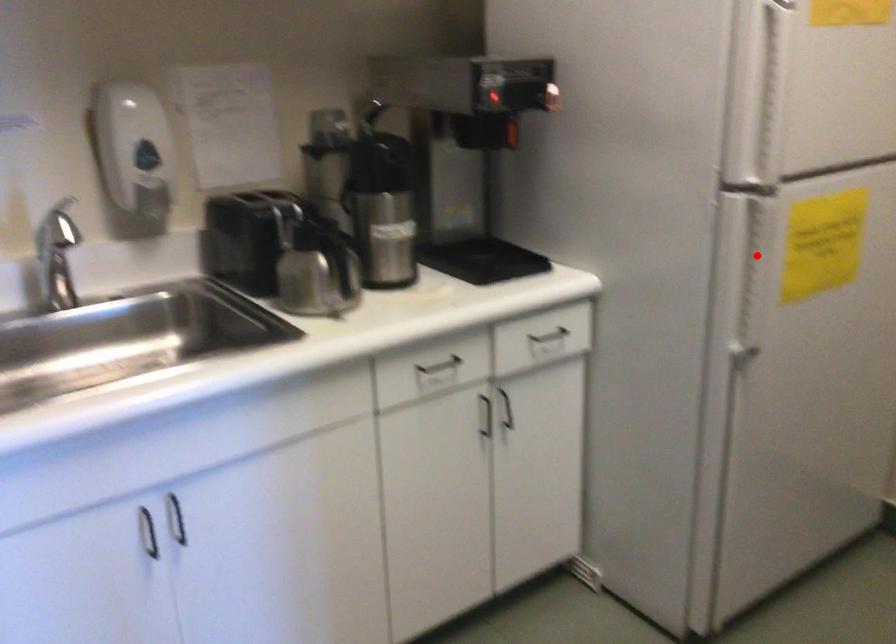
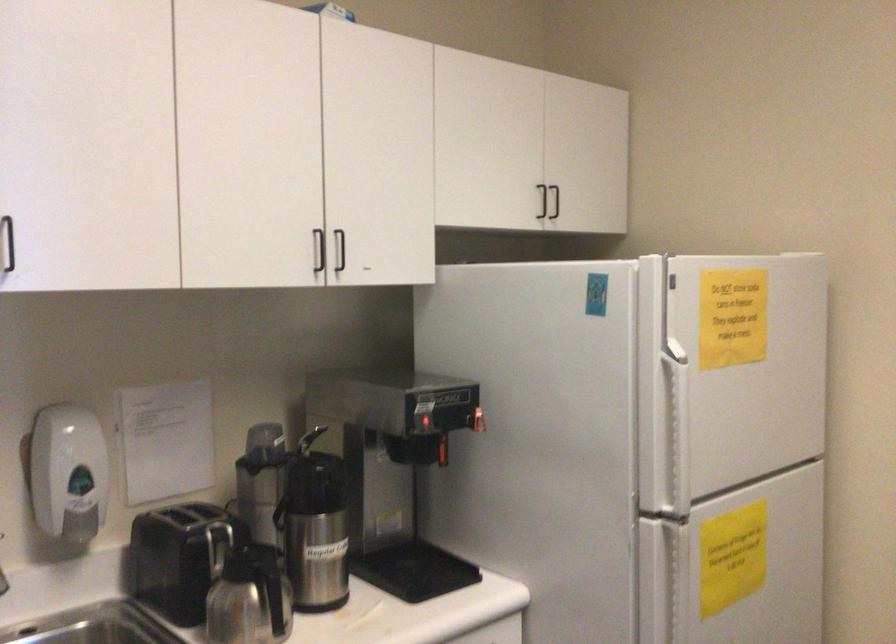
Locate, in the second image, the point that corresponds to the highlighted location in the first image.

(675, 583)